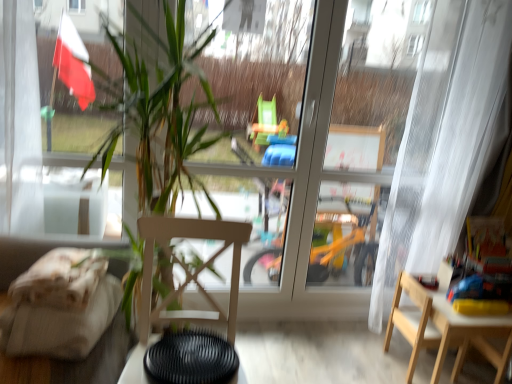
The image size is (512, 384). I want to click on wooden table at lower right, placed as the 2th table when sorted from front to back, so click(469, 336).

This screenshot has width=512, height=384. In order to click on black matte table at lower center, positioned as the first table in front-to-back order in this screenshot , I will do `click(137, 364)`.

In order to face light wood chair at lower right, the 1th chair positioned from the back, should I rotate leftwards or rightwards?

To face it directly, rotate right by 21.900 degrees.

The width and height of the screenshot is (512, 384). I want to click on beige fabric couch at left, so click(74, 362).

Are green leafy plant at center and black matte table at lower center, which is counted as the second table, starting from the right, far apart?

green leafy plant at center is actually quite close to black matte table at lower center, which is counted as the second table, starting from the right.

Which object is closer to the camera taking this photo, green leafy plant at center or black matte table at lower center, which is counted as the second table, starting from the back?

green leafy plant at center is closer to the camera.

In the scene shown: Is green leafy plant at center facing away from black matte table at lower center, which is counted as the second table, starting from the back?

Absolutely, green leafy plant at center is directed away from black matte table at lower center, which is counted as the second table, starting from the back.

Considering the relative positions of green leafy plant at center and black matte table at lower center, which is counted as the second table, starting from the right, in the image provided, is green leafy plant at center to the left or to the right of black matte table at lower center, which is counted as the second table, starting from the right,?

From the image, it's evident that green leafy plant at center is to the left of black matte table at lower center, which is counted as the second table, starting from the right.

In the scene shown: Which of these two, wooden chair at center, which is counted as the second chair, starting from the right, or wooden table at lower right, placed as the first table when sorted from back to front, stands shorter?

Standing shorter between the two is wooden table at lower right, placed as the first table when sorted from back to front.

There is a wooden chair at center, marked as the first chair in a left-to-right arrangement. At what (x,y) coordinates should I click in order to perform the action: click on the 2nd table below it (from a real-world perspective). Please return your answer as a coordinate pair (x, y). Looking at the image, I should click on (469, 336).

Consider the image. Is wooden table at lower right, which appears as the second table when viewed from the left, completely or partially inside wooden chair at center, acting as the first chair starting from the front?

Actually, wooden table at lower right, which appears as the second table when viewed from the left, is outside wooden chair at center, acting as the first chair starting from the front.

Between white sheer curtain at right and beige fabric couch at left, which one is positioned behind?

white sheer curtain at right is further from the camera.

Is white sheer curtain at right wider than beige fabric couch at left?

No, white sheer curtain at right is not wider than beige fabric couch at left.

Does white sheer curtain at right contain beige fabric couch at left?

Definitely not — beige fabric couch at left is not inside white sheer curtain at right.

Is white sheer curtain at right at the left side of beige fabric couch at left?

No, white sheer curtain at right is not to the left of beige fabric couch at left.

Can you tell me how much light wood chair at lower right, the second chair in the left-to-right sequence, and green leafy plant at center differ in facing direction?

The angular difference between light wood chair at lower right, the second chair in the left-to-right sequence, and green leafy plant at center is 89.5 degrees.

Is light wood chair at lower right, the second chair in the left-to-right sequence, to the left of green leafy plant at center from the viewer's perspective?

No, light wood chair at lower right, the second chair in the left-to-right sequence, is not to the left of green leafy plant at center.

From the image's perspective, which is above, light wood chair at lower right, the 1th chair when ordered from right to left, or green leafy plant at center?

green leafy plant at center.

How much distance is there between light wood chair at lower right, the second chair in the left-to-right sequence, and green leafy plant at center?

They are 4.25 feet apart.

From the image's perspective, is black matte table at lower center, arranged as the 1th table when viewed from the left, above or below wooden table at lower right, placed as the 2th table when sorted from front to back?

black matte table at lower center, arranged as the 1th table when viewed from the left, is above wooden table at lower right, placed as the 2th table when sorted from front to back.

Between point (134, 372) and point (480, 324), which one is positioned in front?

Point (134, 372)

How distant is black matte table at lower center, arranged as the 1th table when viewed from the left, from wooden table at lower right, placed as the 2th table when sorted from front to back?

black matte table at lower center, arranged as the 1th table when viewed from the left, and wooden table at lower right, placed as the 2th table when sorted from front to back, are 1.43 meters apart.

How many degrees apart are the facing directions of black matte table at lower center, arranged as the 1th table when viewed from the left, and wooden table at lower right, placed as the first table when sorted from back to front?

178 degrees.

Considering the relative sizes of wooden table at lower right, placed as the 2th table when sorted from front to back, and light wood chair at lower right, the 1th chair positioned from the back, in the image provided, is wooden table at lower right, placed as the 2th table when sorted from front to back, bigger than light wood chair at lower right, the 1th chair positioned from the back,?

Yes.

Is wooden table at lower right, positioned as the first table in right-to-left order, not near light wood chair at lower right, the second chair in the left-to-right sequence?

wooden table at lower right, positioned as the first table in right-to-left order, is actually quite close to light wood chair at lower right, the second chair in the left-to-right sequence.

In order to click on table on the right of light wood chair at lower right, the 1th chair positioned from the back in this screenshot , I will do `click(469, 336)`.

Is point (465, 342) farther from viewer compared to point (460, 353)?

Yes, point (465, 342) is farther from viewer.

Does black matte table at lower center, arranged as the 1th table when viewed from the left, lie behind light wood chair at lower right, the 1th chair positioned from the back?

No.

From the image's perspective, is black matte table at lower center, which is counted as the second table, starting from the right, located above or below light wood chair at lower right, the 1th chair when ordered from right to left?

black matte table at lower center, which is counted as the second table, starting from the right, is situated higher than light wood chair at lower right, the 1th chair when ordered from right to left, in the image.

Does black matte table at lower center, positioned as the first table in front-to-back order, appear on the right side of light wood chair at lower right, the 1th chair positioned from the back?

In fact, black matte table at lower center, positioned as the first table in front-to-back order, is to the left of light wood chair at lower right, the 1th chair positioned from the back.

Between black matte table at lower center, arranged as the 1th table when viewed from the left, and light wood chair at lower right, the second chair in the left-to-right sequence, which one has larger width?

With larger width is black matte table at lower center, arranged as the 1th table when viewed from the left.

At what (x,y) coordinates should I click in order to perform the action: click on houseplant located in front of the black matte table at lower center, which is counted as the second table, starting from the back. Please return your answer as a coordinate pair (x, y). The width and height of the screenshot is (512, 384). Looking at the image, I should click on (168, 172).

This screenshot has width=512, height=384. I want to click on the 2nd table behind when counting from the wooden chair at center, placed as the second chair when sorted from back to front, so click(x=469, y=336).

From the image, which object appears to be nearer to white sheer curtain at right, beige fabric couch at left or wooden chair at center, marked as the first chair in a left-to-right arrangement?

wooden chair at center, marked as the first chair in a left-to-right arrangement, is positioned closer to the anchor white sheer curtain at right.

Which object lies further to the anchor point green leafy plant at center, light wood chair at lower right, the 1th chair positioned from the back, or black matte table at lower center, positioned as the first table in front-to-back order?

The object further to green leafy plant at center is light wood chair at lower right, the 1th chair positioned from the back.

Considering their positions, is beige fabric couch at left positioned further to white sheer curtain at right than light wood chair at lower right, the second chair in the left-to-right sequence?

beige fabric couch at left is positioned further to the anchor white sheer curtain at right.

Based on their spatial positions, is beige fabric couch at left or wooden table at lower right, which appears as the second table when viewed from the left, further from green leafy plant at center?

wooden table at lower right, which appears as the second table when viewed from the left, lies further to green leafy plant at center than the other object.

Considering their positions, is green leafy plant at center positioned further to wooden chair at center, which is counted as the second chair, starting from the right, than wooden table at lower right, placed as the 2th table when sorted from front to back?

wooden table at lower right, placed as the 2th table when sorted from front to back.

Estimate the real-world distances between objects in this image. Which object is closer to beige fabric couch at left, light wood chair at lower right, the second chair in the left-to-right sequence, or wooden chair at center, marked as the first chair in a left-to-right arrangement?

Result: wooden chair at center, marked as the first chair in a left-to-right arrangement.

Looking at the image, which one is located further to beige fabric couch at left, black matte table at lower center, which is counted as the second table, starting from the back, or wooden table at lower right, placed as the 2th table when sorted from front to back?

Among the two, wooden table at lower right, placed as the 2th table when sorted from front to back, is located further to beige fabric couch at left.

Based on their spatial positions, is white sheer curtain at right or beige fabric couch at left further from light wood chair at lower right, which ranks as the 2th chair in front-to-back order?

beige fabric couch at left lies further to light wood chair at lower right, which ranks as the 2th chair in front-to-back order, than the other object.

Identify the location of chair between black matte table at lower center, arranged as the 1th table when viewed from the left, and wooden table at lower right, positioned as the first table in right-to-left order. The height and width of the screenshot is (384, 512). (413, 320).

Locate an element on the screen. The height and width of the screenshot is (384, 512). table between green leafy plant at center and white sheer curtain at right from left to right is located at coordinates (137, 364).

Identify the location of table between wooden chair at center, marked as the first chair in a left-to-right arrangement, and light wood chair at lower right, the 1th chair positioned from the back. (137, 364).

Where is `chair between wooden chair at center, marked as the first chair in a left-to-right arrangement, and wooden table at lower right, placed as the 2th table when sorted from front to back, from left to right`? The height and width of the screenshot is (384, 512). chair between wooden chair at center, marked as the first chair in a left-to-right arrangement, and wooden table at lower right, placed as the 2th table when sorted from front to back, from left to right is located at coordinates (413, 320).